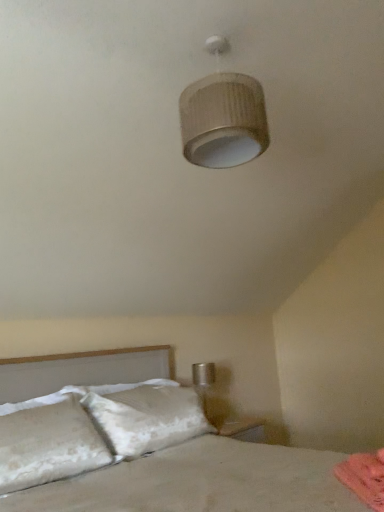
You are a GUI agent. You are given a task and a screenshot of the screen. Output one action in this format:
    pyautogui.click(x=<x>, y=<y>)
    Task: Click on the empty space that is ontop of matte beige lampshade at upper center
    The width and height of the screenshot is (384, 512).
    Given the screenshot: What is the action you would take?
    pyautogui.click(x=223, y=36)